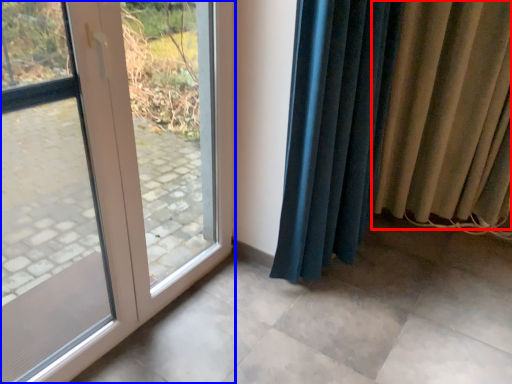
Question: Which point is further to the camera, curtain (highlighted by a red box) or door (highlighted by a blue box)?

Choices:
 (A) curtain
 (B) door

Answer: (A)